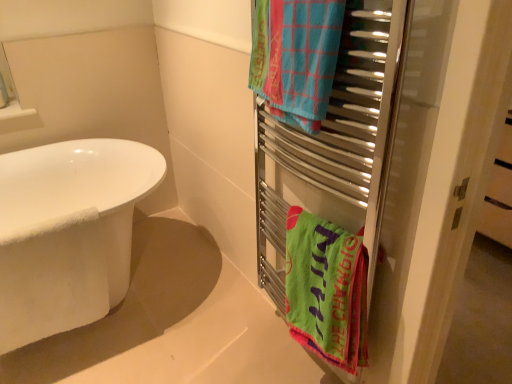
Identify the location of vacant space situated above white matte bathtub at lower left (from a real-world perspective). (167, 323).